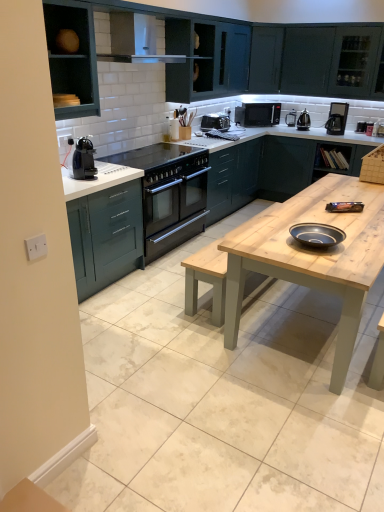
Question: Is teal matte cabinet at upper left, arranged as the 1th cabinetry when viewed from the front, touching wooden countertop at right, the 2th cabinetry viewed from the right?

Choices:
 (A) no
 (B) yes

Answer: (A)

Question: Is teal matte cabinet at upper left, the 4th cabinetry viewed from the right, far away from wooden countertop at right, marked as the fourth cabinetry in a front-to-back arrangement?

Choices:
 (A) no
 (B) yes

Answer: (B)

Question: Can you confirm if teal matte cabinet at upper left, arranged as the 1th cabinetry when viewed from the front, is bigger than wooden countertop at right, which appears as the first cabinetry when viewed from the back?

Choices:
 (A) no
 (B) yes

Answer: (A)

Question: From a real-world perspective, is teal matte cabinet at upper left, arranged as the 4th cabinetry when viewed from the back, physically below wooden countertop at right, marked as the fourth cabinetry in a front-to-back arrangement?

Choices:
 (A) no
 (B) yes

Answer: (A)

Question: Does teal matte cabinet at upper left, arranged as the 4th cabinetry when viewed from the back, appear on the left side of wooden countertop at right, the 2th cabinetry viewed from the right?

Choices:
 (A) no
 (B) yes

Answer: (B)

Question: Does point (87, 150) appear closer or farther from the camera than point (92, 29)?

Choices:
 (A) farther
 (B) closer

Answer: (A)

Question: In terms of height, does black plastic coffee machine at left look taller or shorter compared to teal matte cabinet at upper left, arranged as the 4th cabinetry when viewed from the back?

Choices:
 (A) short
 (B) tall

Answer: (A)

Question: Do you think black plastic coffee machine at left is within teal matte cabinet at upper left, arranged as the 1th cabinetry when viewed from the front, or outside of it?

Choices:
 (A) outside
 (B) inside

Answer: (A)

Question: From a real-world perspective, is black plastic coffee machine at left positioned above or below teal matte cabinet at upper left, arranged as the 1th cabinetry when viewed from the front?

Choices:
 (A) above
 (B) below

Answer: (B)

Question: Do you think matte teal cabinet at upper center, the third cabinetry positioned from the back, is within satin black toaster at upper center, the 1th appliance positioned from the left, or outside of it?

Choices:
 (A) outside
 (B) inside

Answer: (A)

Question: Is point (167, 45) positioned closer to the camera than point (221, 129)?

Choices:
 (A) closer
 (B) farther

Answer: (A)

Question: From the image's perspective, relative to satin black toaster at upper center, which is counted as the 4th appliance, starting from the right, is matte teal cabinet at upper center, the second cabinetry when ordered from left to right, above or below?

Choices:
 (A) below
 (B) above

Answer: (B)

Question: Considering the positions of matte teal cabinet at upper center, the 2th cabinetry viewed from the front, and satin black toaster at upper center, the 1th appliance positioned from the left, in the image, is matte teal cabinet at upper center, the 2th cabinetry viewed from the front, wider or thinner than satin black toaster at upper center, the 1th appliance positioned from the left,?

Choices:
 (A) wide
 (B) thin

Answer: (A)

Question: Considering the relative positions of metallic silver toaster at upper right, the first appliance when ordered from right to left, and light wood table at center in the image provided, is metallic silver toaster at upper right, the first appliance when ordered from right to left, to the left or to the right of light wood table at center?

Choices:
 (A) left
 (B) right

Answer: (B)

Question: Considering the positions of metallic silver toaster at upper right, the first appliance when ordered from right to left, and light wood table at center in the image, is metallic silver toaster at upper right, the first appliance when ordered from right to left, wider or thinner than light wood table at center?

Choices:
 (A) thin
 (B) wide

Answer: (A)